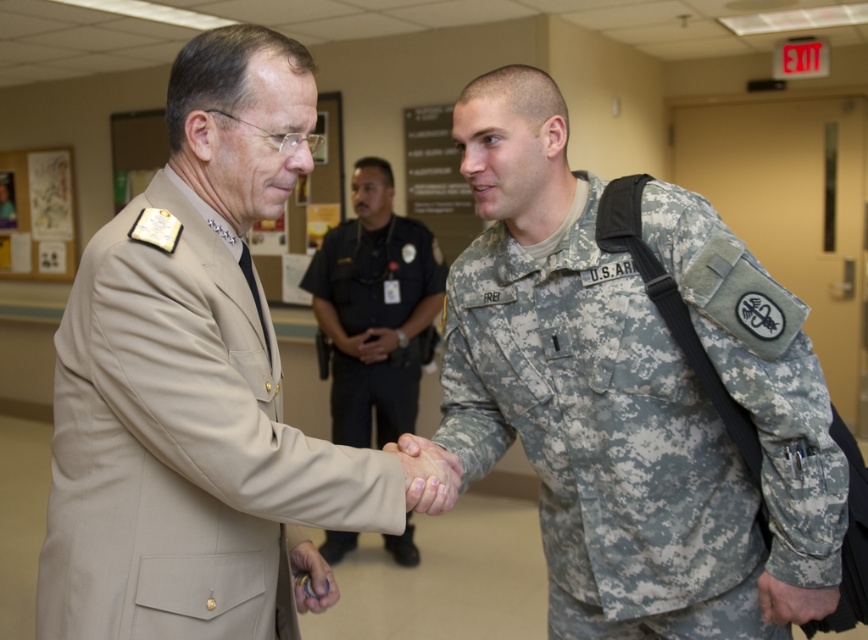
Question: Which of the following is the farthest from the observer?

Choices:
 (A) camouflage fabric hand at center
 (B) tan fabric uniform at center

Answer: (A)

Question: Among these objects, which one is farthest from the camera?

Choices:
 (A) camouflage fabric hand at center
 (B) tan fabric uniform at center
 (C) tan uniform at center

Answer: (C)

Question: Can you confirm if tan fabric uniform at center is smaller than tan uniform at center?

Choices:
 (A) yes
 (B) no

Answer: (A)

Question: Can you confirm if tan fabric uniform at center is positioned to the left of metallic ring at center?

Choices:
 (A) no
 (B) yes

Answer: (B)

Question: Which object appears closest to the camera in this image?

Choices:
 (A) tan fabric uniform at center
 (B) metallic ring at center

Answer: (A)

Question: Does camouflage fabric uniform at center appear over tan fabric uniform at center?

Choices:
 (A) yes
 (B) no

Answer: (B)